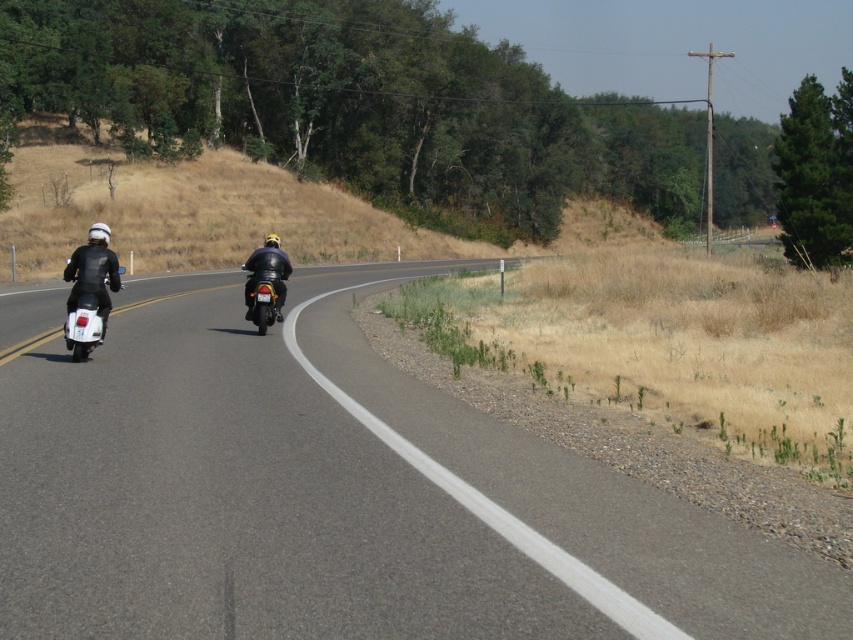
You are a delivery driver who needs to pass through the curve on the road. You see the shiny black motorcycle at center and the shiny silver scooter at left. Which vehicle should you overtake first to navigate the curve safely?

You should overtake the shiny silver scooter at left first because it is positioned closer to the left side of the road compared to the shiny black motorcycle at center, allowing for safer navigation through the curve.

You are standing at the point marked as point [314,298] in the image. You want to walk to the nearest road sign, which is located 30 meters away from you. Can you reach it without crossing any roads?

The point [314,298] is 27.87 meters away from the viewer. Since the road sign is 30 meters away, you can reach it without crossing any roads as the distance is within the required range.